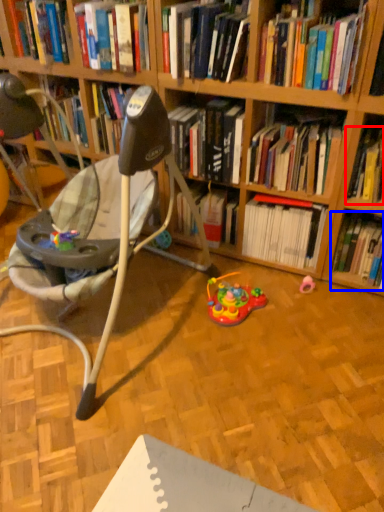
Question: Which point is closer to the camera, book (highlighted by a red box) or book (highlighted by a blue box)?

Choices:
 (A) book
 (B) book

Answer: (A)